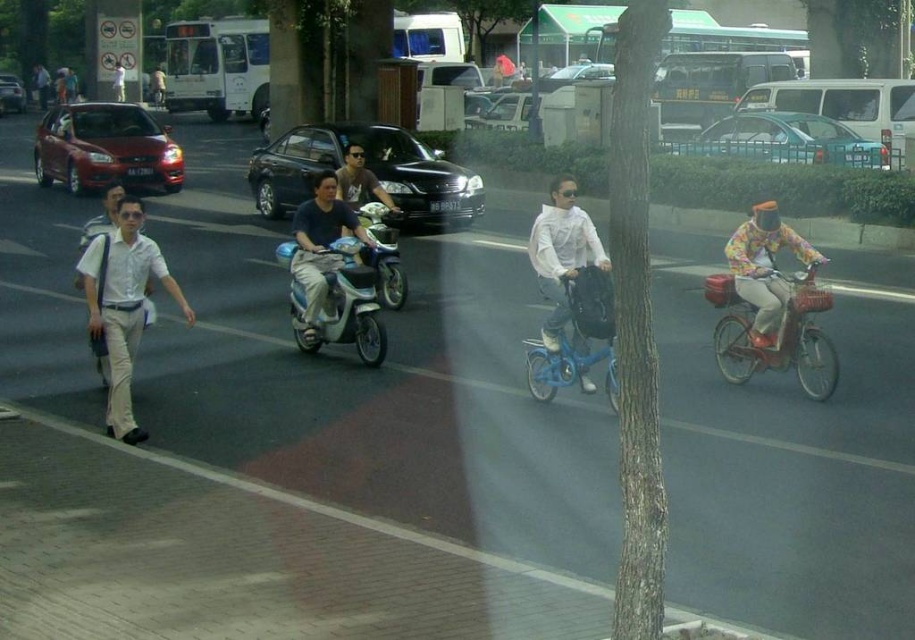
Can you confirm if teal matte car at upper right is positioned below blue matte bicycle at center?

Actually, teal matte car at upper right is above blue matte bicycle at center.

Does point (744, 131) come behind point (565, 340)?

Yes, point (744, 131) is farther from viewer.

The image size is (915, 640). Find the location of `teal matte car at upper right`. teal matte car at upper right is located at coordinates (784, 140).

Who is more forward, (x=558, y=362) or (x=530, y=106)?

Positioned in front is point (x=558, y=362).

Is blue matte bicycle at center positioned before matte black sedan at center?

Yes, blue matte bicycle at center is in front of matte black sedan at center.

Which is in front, point (571, 296) or point (519, 106)?

Positioned in front is point (571, 296).

Locate an element on the screen. blue matte bicycle at center is located at coordinates (576, 339).

Is the position of blue matte bicycle at center less distant than that of floral fabric jacket at right?

Yes, blue matte bicycle at center is closer to the viewer.

In order to click on blue matte bicycle at center in this screenshot , I will do `click(576, 339)`.

Locate an element on the screen. blue matte bicycle at center is located at coordinates (576, 339).